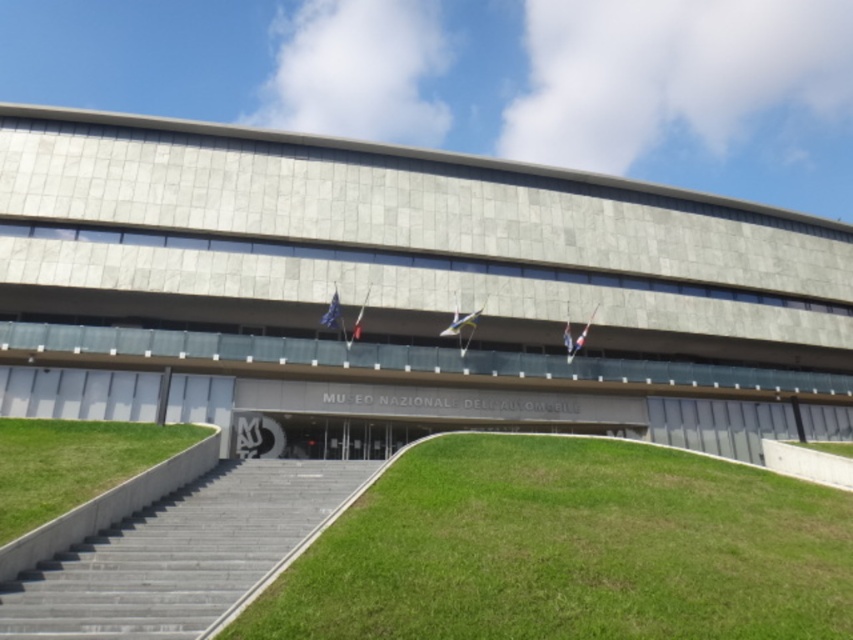
Question: Which object is farther from the camera taking this photo?

Choices:
 (A) green grass at lower left
 (B) gray concrete stairs at center
 (C) green grass at lower center

Answer: (A)

Question: Does green grass at lower center appear on the right side of green grass at lower left?

Choices:
 (A) no
 (B) yes

Answer: (B)

Question: Does green grass at lower center come behind green grass at lower left?

Choices:
 (A) yes
 (B) no

Answer: (B)

Question: Which object is positioned closest to the green grass at lower left?

Choices:
 (A) green grass at lower center
 (B) gray concrete stairs at center

Answer: (B)

Question: Among these points, which one is nearest to the camera?

Choices:
 (A) (97, 628)
 (B) (93, 516)

Answer: (A)

Question: Does green grass at lower center have a smaller size compared to green grass at lower left?

Choices:
 (A) no
 (B) yes

Answer: (A)